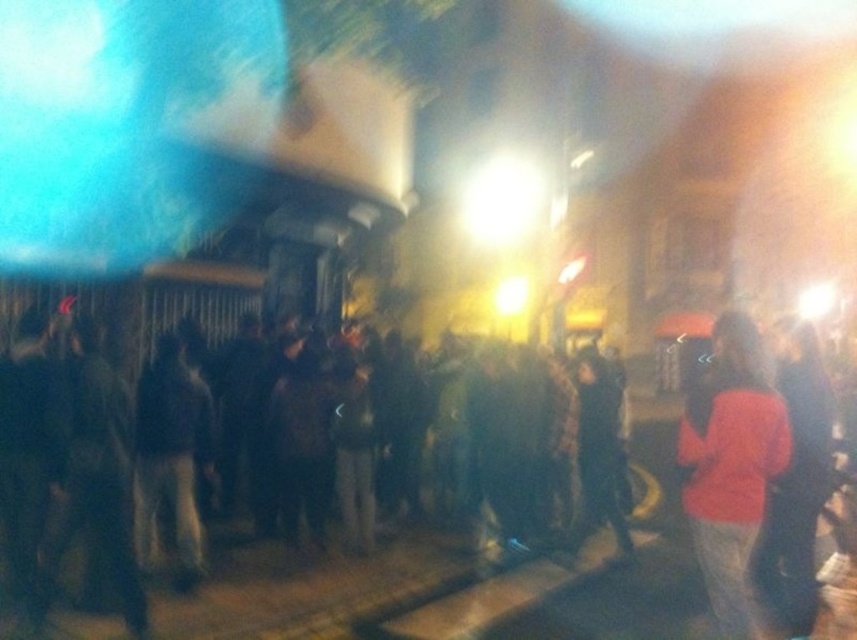
Question: Which object appears closest to the camera in this image?

Choices:
 (A) dark matte clothing at center
 (B) orange fabric shirt at right

Answer: (B)

Question: Which point is closer to the camera?

Choices:
 (A) dark matte clothing at center
 (B) orange fabric shirt at right

Answer: (B)

Question: Is dark matte clothing at center closer to the viewer compared to orange fabric shirt at right?

Choices:
 (A) yes
 (B) no

Answer: (B)

Question: Is dark matte clothing at center positioned at the back of orange fabric shirt at right?

Choices:
 (A) no
 (B) yes

Answer: (B)

Question: Which object is farther from the camera taking this photo?

Choices:
 (A) orange fabric shirt at right
 (B) dark matte clothing at center

Answer: (B)

Question: Is dark matte clothing at center thinner than orange fabric shirt at right?

Choices:
 (A) yes
 (B) no

Answer: (B)